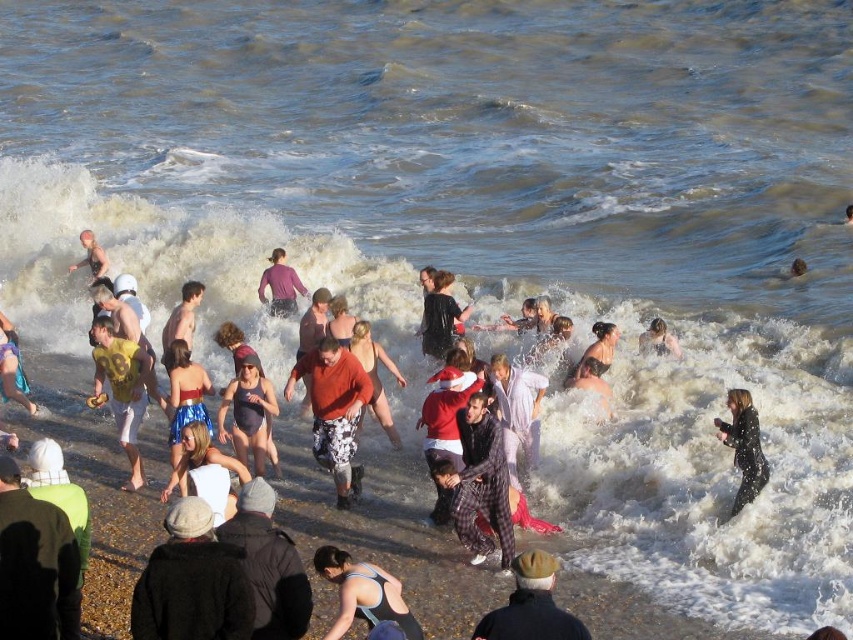
You are a photographer at the beach scene described. You need to capture a photo that includes both the orange fabric sweater at center and the black matte coat at lower right. Considering their sizes, which object will appear bigger in the photo?

The orange fabric sweater at center will appear bigger in the photo because it is larger in size than the black matte coat at lower right.

You are a photographer standing on the beach and want to capture both the matte black swimsuit at lower center and the black matte coat at lower right in the same frame. Which object should you position closer to the center of your camera viewfinder to ensure both are fully visible?

You should position the matte black swimsuit at lower center closer to the center of your camera viewfinder because it might be wider than the black matte coat at lower right, ensuring both fit within the frame.

You are a photographer at the beach scene. You need to capture a photo that includes both the orange fabric sweater at center and the black matte coat at lower right. Which object should you position closer to the foreground to ensure both are visible in the frame?

The orange fabric sweater at center should be positioned closer to the foreground because it is located above the black matte coat at lower right, so adjusting the camera angle to focus on the sweater will naturally include the coat in the background.